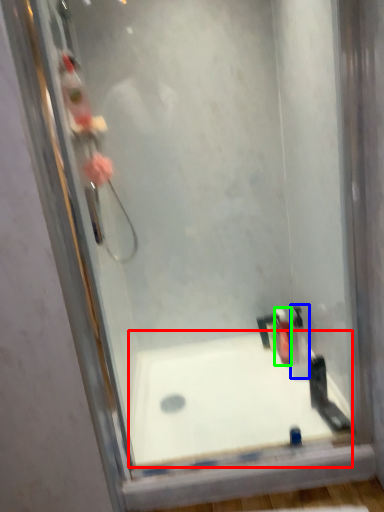
Question: Which object is positioned closest to bathtub (highlighted by a red box)? Select from toiletry (highlighted by a blue box) and toiletry (highlighted by a green box).

Choices:
 (A) toiletry
 (B) toiletry

Answer: (A)